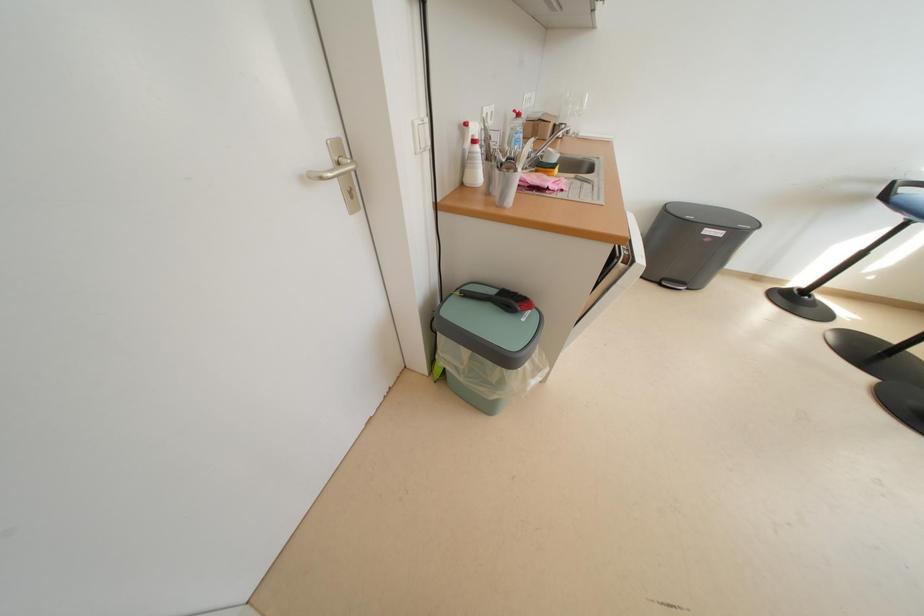
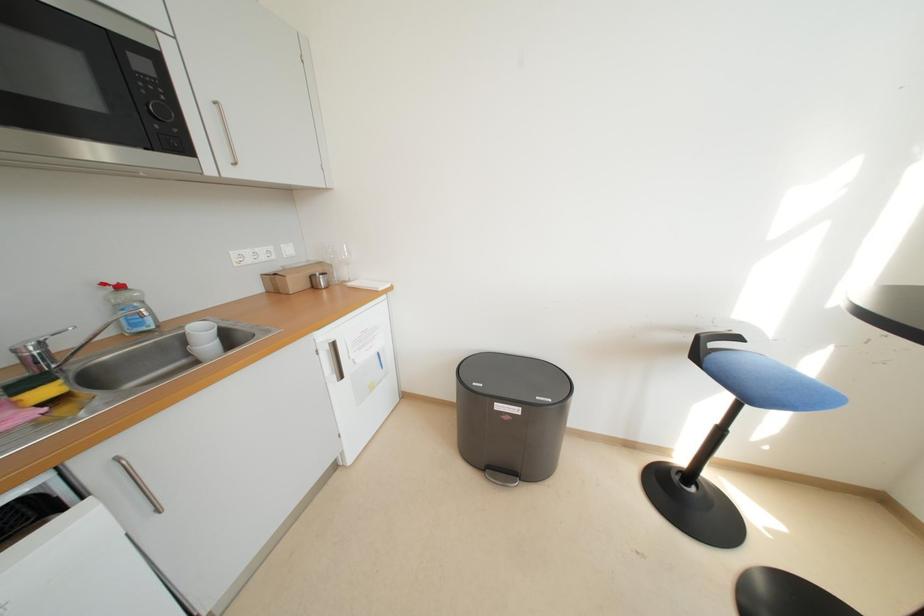
Question: In a continuous first-person perspective shot, in which direction is the camera moving?

Choices:
 (A) Left
 (B) Right
 (C) Forward
 (D) Backward

Answer: (B)